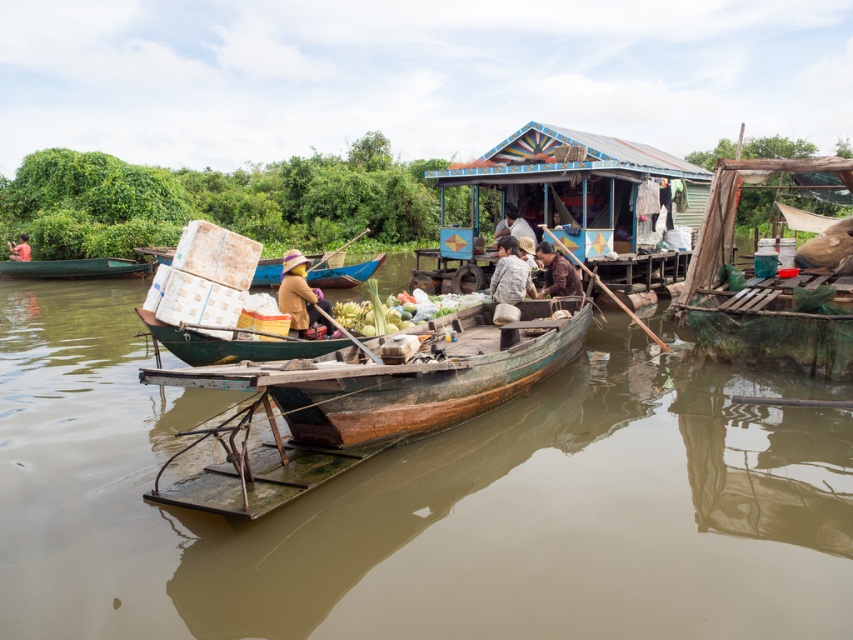
Question: Estimate the real-world distances between objects in this image. Which object is farther from the matte brown hat at center?

Choices:
 (A) matte brown hat at upper center
 (B) brown wooden boat at center
 (C) brown fabric person at center
 (D) camouflage fabric shirt at center

Answer: (A)

Question: Among these points, which one is nearest to the camera?

Choices:
 (A) (579, 285)
 (B) (12, 259)
 (C) (379, 257)

Answer: (A)

Question: Where is brown wooden boat at center located in relation to green wooden canoe at left in the image?

Choices:
 (A) right
 (B) left

Answer: (A)

Question: Which object is positioned closest to the brown wooden boat at center?

Choices:
 (A) matte brown hat at center
 (B) green wooden canoe at left
 (C) wooden boat at center
 (D) white fabric at center

Answer: (C)

Question: Does camouflage fabric shirt at center come behind matte brown hat at upper center?

Choices:
 (A) yes
 (B) no

Answer: (B)

Question: Does white fabric at center appear on the left side of matte brown hat at upper center?

Choices:
 (A) yes
 (B) no

Answer: (B)